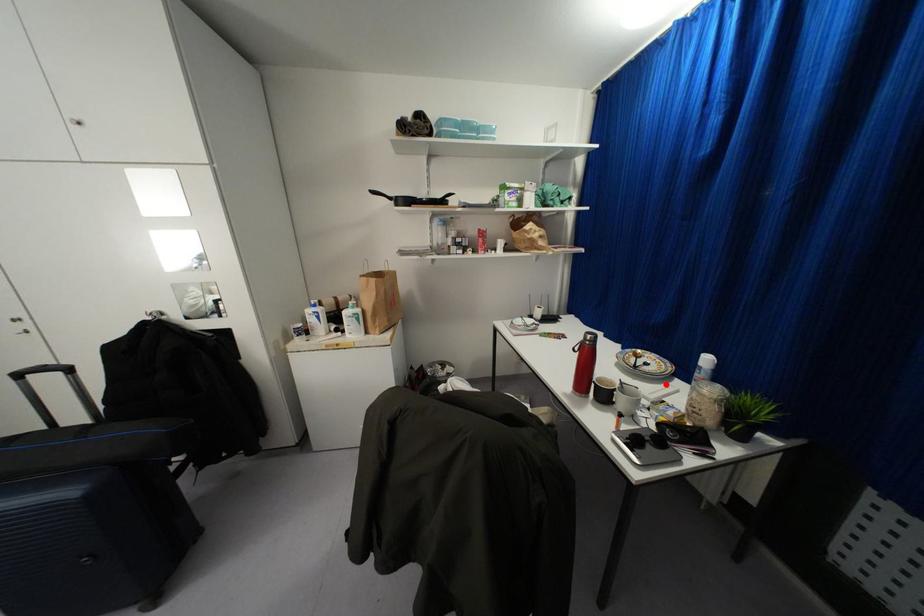
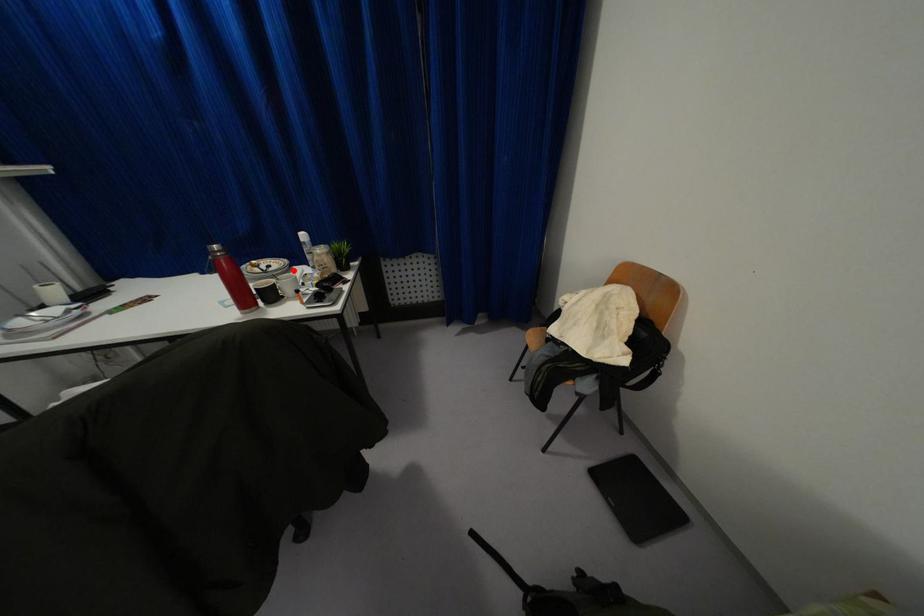
I am providing you with two images of the same scene from different viewpoints. A red point is marked on the first image and another point is marked on the second image. Do the highlighted points in image1 and image2 indicate the same real-world spot?

Yes